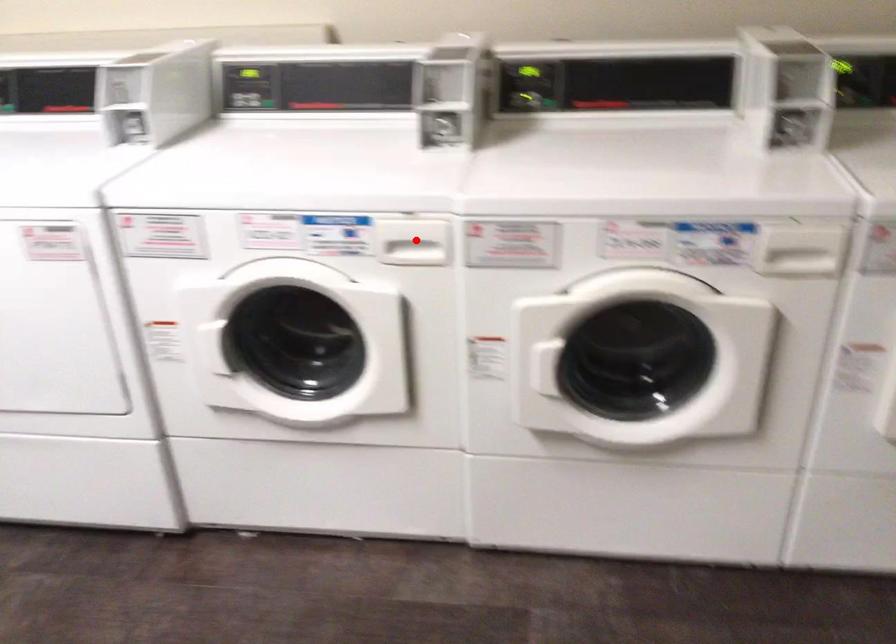
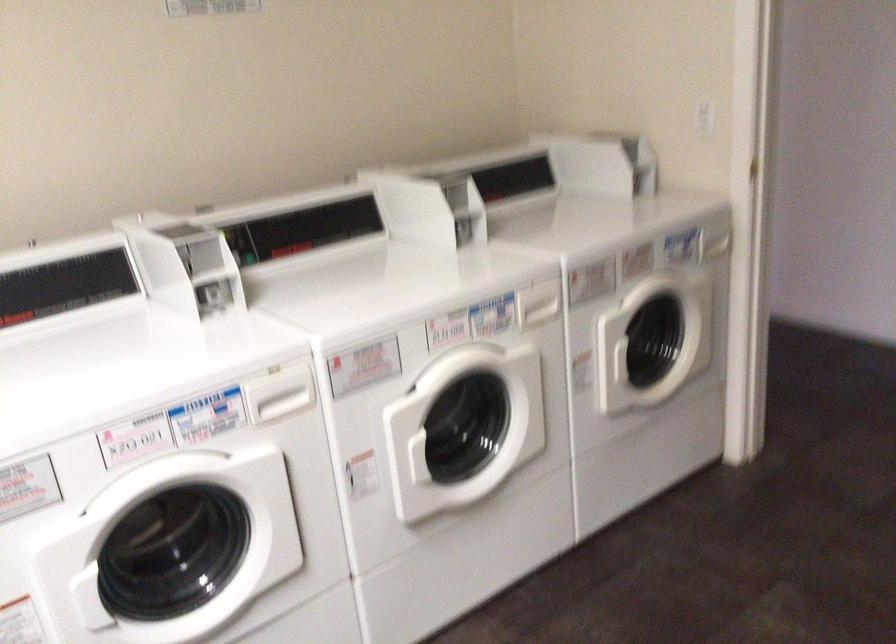
In the second image, find the point that corresponds to the highlighted location in the first image.

(279, 393)